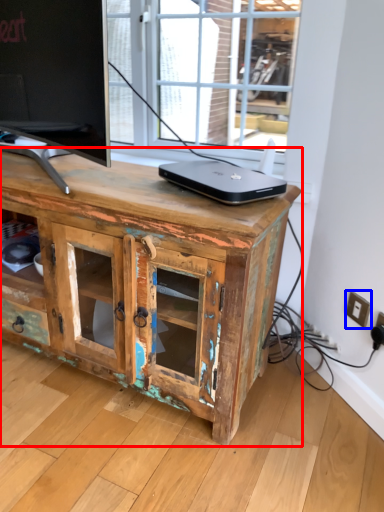
Question: Which object appears closest to the camera in this image, chest of drawers (highlighted by a red box) or electric outlet (highlighted by a blue box)?

Choices:
 (A) chest of drawers
 (B) electric outlet

Answer: (A)